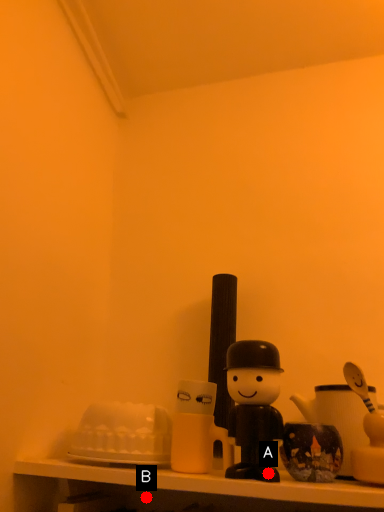
Question: Two points are circled on the image, labeled by A and B beside each circle. Which point appears closest to the camera in this image?

Choices:
 (A) A is closer
 (B) B is closer

Answer: (A)